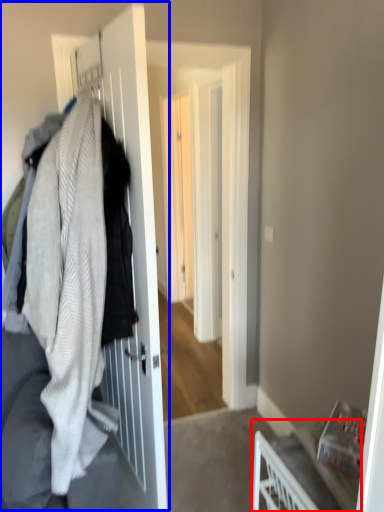
Question: Which point is further to the camera, furniture (highlighted by a red box) or closet (highlighted by a blue box)?

Choices:
 (A) furniture
 (B) closet

Answer: (A)